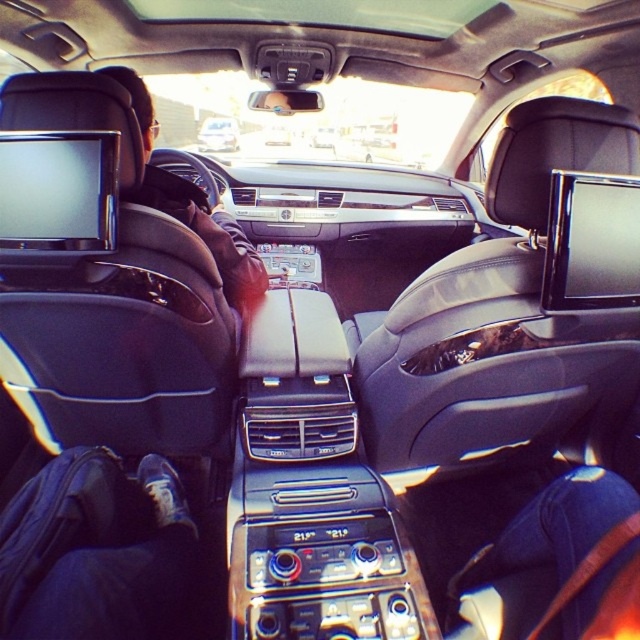
Question: Is leather jacket at left smaller than metallic silver car at center?

Choices:
 (A) no
 (B) yes

Answer: (B)

Question: Considering the relative positions of leather jacket at left and metallic silver car at center in the image provided, where is leather jacket at left located with respect to metallic silver car at center?

Choices:
 (A) left
 (B) right

Answer: (B)

Question: Is leather jacket at left positioned before metallic silver car at center?

Choices:
 (A) yes
 (B) no

Answer: (A)

Question: Which point appears closest to the camera in this image?

Choices:
 (A) (227, 140)
 (B) (240, 272)

Answer: (B)